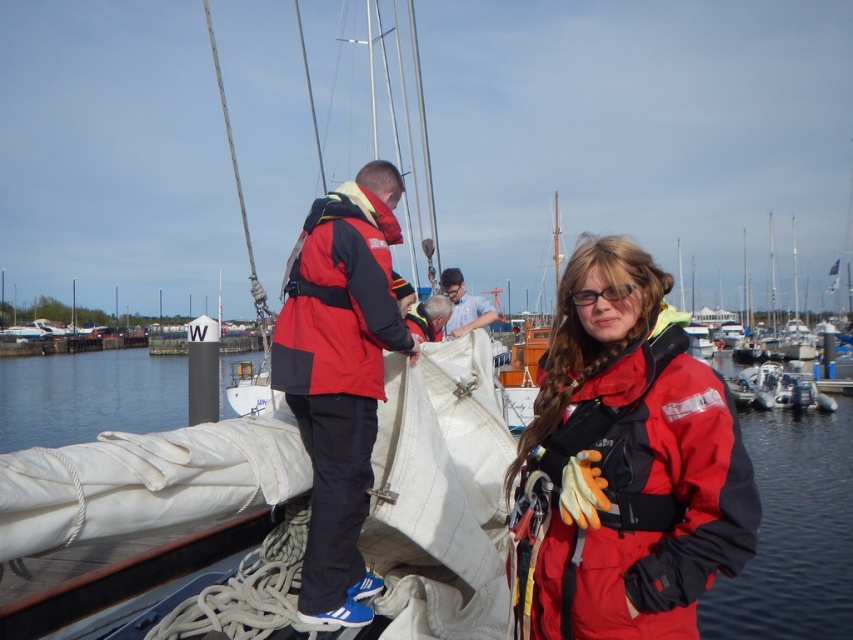
You are a photographer trying to capture a photo of the white fabric at center and the red matte jacket at center. Since you want to emphasize the size difference between them, which object should you focus on to highlight its larger size?

The white fabric at center has a larger size compared to the red matte jacket at center, so focusing on the white fabric at center will emphasize its larger size.